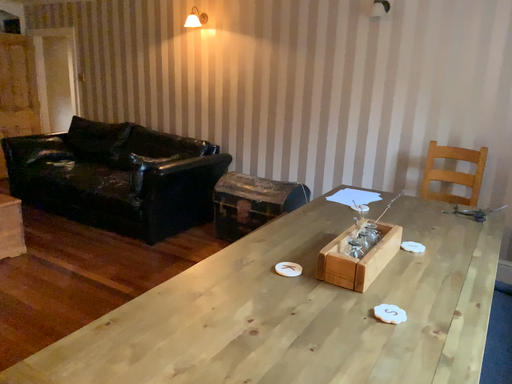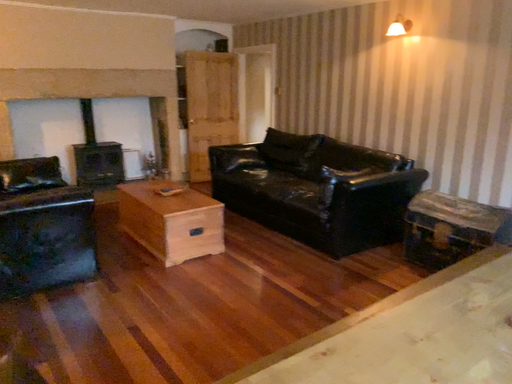
Question: How did the camera likely rotate when shooting the video?

Choices:
 (A) rotated left
 (B) rotated right

Answer: (A)